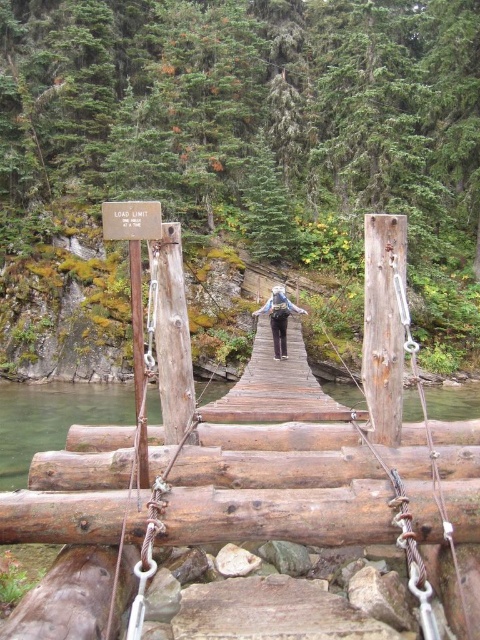
You are hiking and see the brown wooden bridge at center and the matte gray backpack at center. Which object is positioned to the right side?

The brown wooden bridge at center is to the right of the matte gray backpack at center, so the brown wooden bridge at center is positioned to the right side.

You are standing on the rustic wooden suspension bridge and notice two points marked on the bridge. The first point is at coordinate point (233, 502) and the second is at point (33, 401). Which point is nearer to you as you stand on the bridge?

Point (233, 502) is closer to the viewer than point (33, 401).